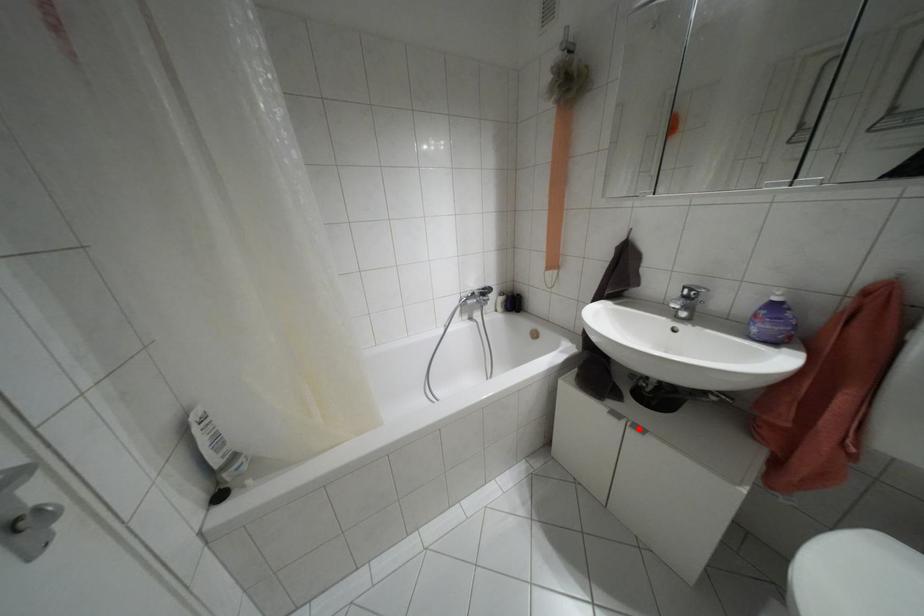
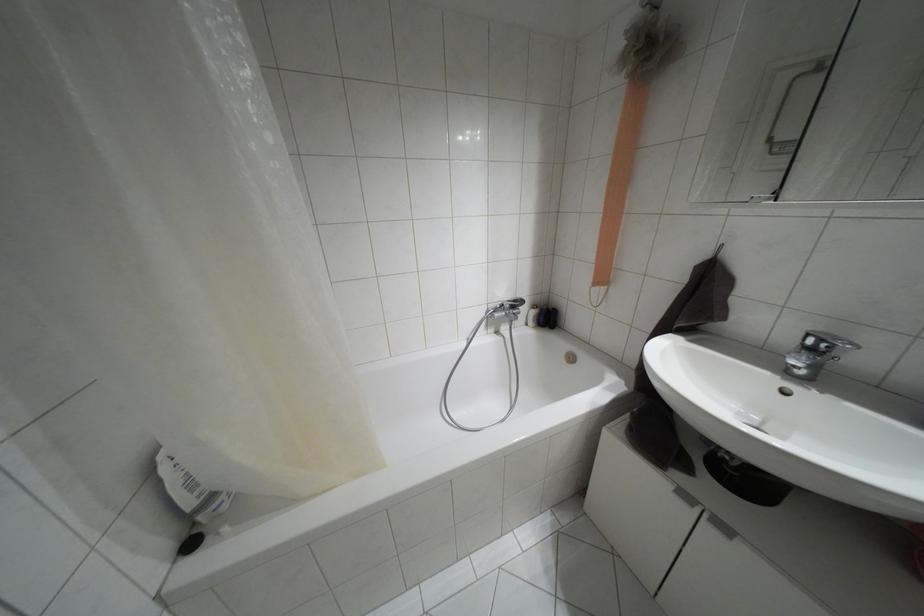
In the second image, find the point that corresponds to the highlighted location in the first image.

(723, 528)